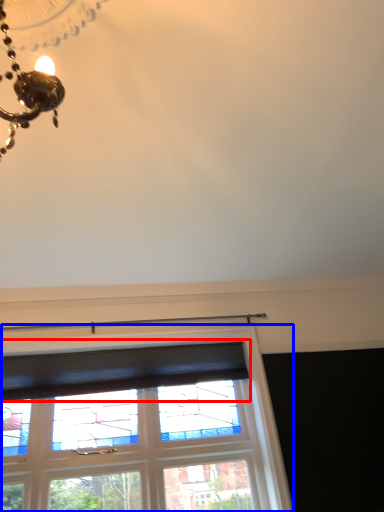
Question: Which object appears closest to the camera in this image, curtain (highlighted by a red box) or window (highlighted by a blue box)?

Choices:
 (A) curtain
 (B) window

Answer: (B)